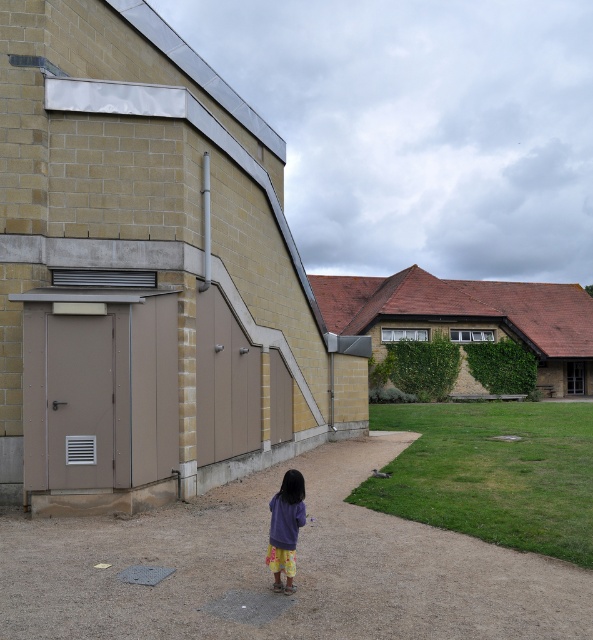
Question: Is dirt path at lower center smaller than purple fabric at center?

Choices:
 (A) yes
 (B) no

Answer: (B)

Question: Is dirt path at lower center bigger than purple fabric at center?

Choices:
 (A) yes
 (B) no

Answer: (A)

Question: Is dirt path at lower center bigger than purple fabric at center?

Choices:
 (A) yes
 (B) no

Answer: (A)

Question: Which point appears farthest from the camera in this image?

Choices:
 (A) (272, 557)
 (B) (273, 470)

Answer: (B)